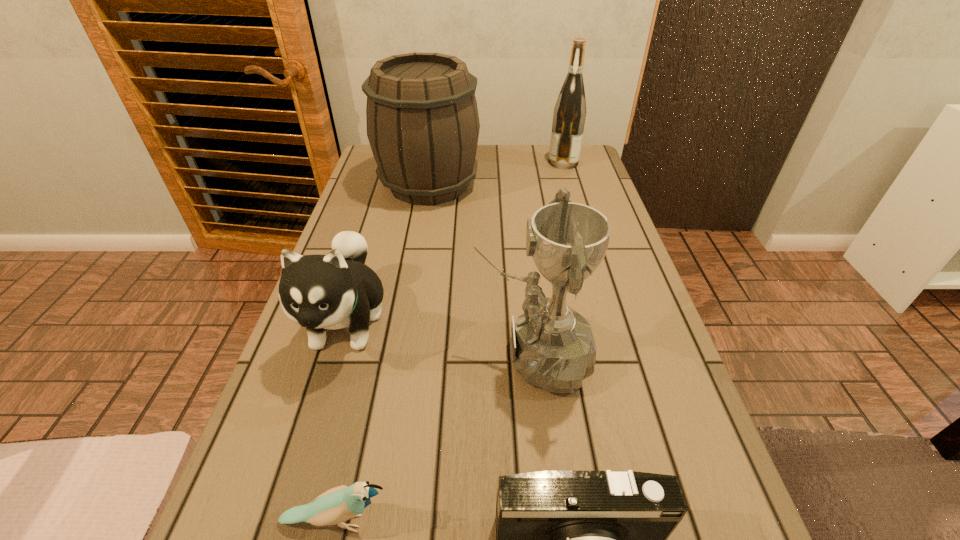
Image resolution: width=960 pixels, height=540 pixels. Find the location of `vacant area located 0.120m at the face of the puppy`. vacant area located 0.120m at the face of the puppy is located at coordinates (310, 442).

The height and width of the screenshot is (540, 960). I want to click on free space located at the face of the shortest object, so click(454, 522).

The image size is (960, 540). Find the location of `wine bottle that is at the far edge`. wine bottle that is at the far edge is located at coordinates (569, 115).

Find the location of a particular element. wine bucket located in the far edge section of the desktop is located at coordinates (423, 125).

Where is `wine bucket that is at the left edge`? The width and height of the screenshot is (960, 540). wine bucket that is at the left edge is located at coordinates (423, 125).

Locate an element on the screen. This screenshot has width=960, height=540. puppy that is at the left edge is located at coordinates (333, 291).

Where is `bird positioned at the left edge`? The image size is (960, 540). bird positioned at the left edge is located at coordinates (337, 505).

Find the location of `wine bottle at the right edge`. wine bottle at the right edge is located at coordinates (569, 115).

Where is `award that is at the right edge`? This screenshot has height=540, width=960. award that is at the right edge is located at coordinates (552, 345).

Where is `object at the far left corner`? object at the far left corner is located at coordinates (423, 125).